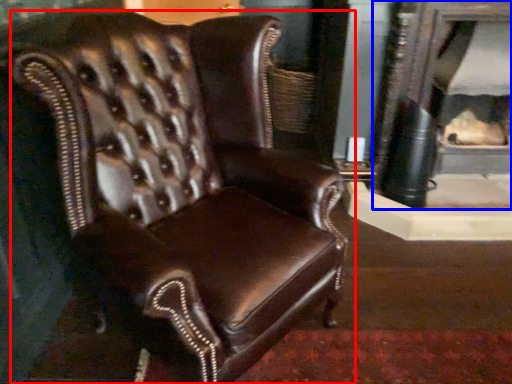
Question: Which object is closer to the camera taking this photo, chair (highlighted by a red box) or fireplace (highlighted by a blue box)?

Choices:
 (A) chair
 (B) fireplace

Answer: (A)